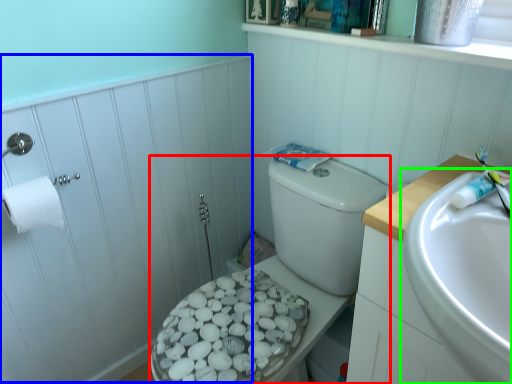
Question: Estimate the real-world distances between objects in this image. Which object is farther from porcelain (highlighted by a red box), side (highlighted by a blue box) or sink (highlighted by a green box)?

Choices:
 (A) side
 (B) sink

Answer: (B)